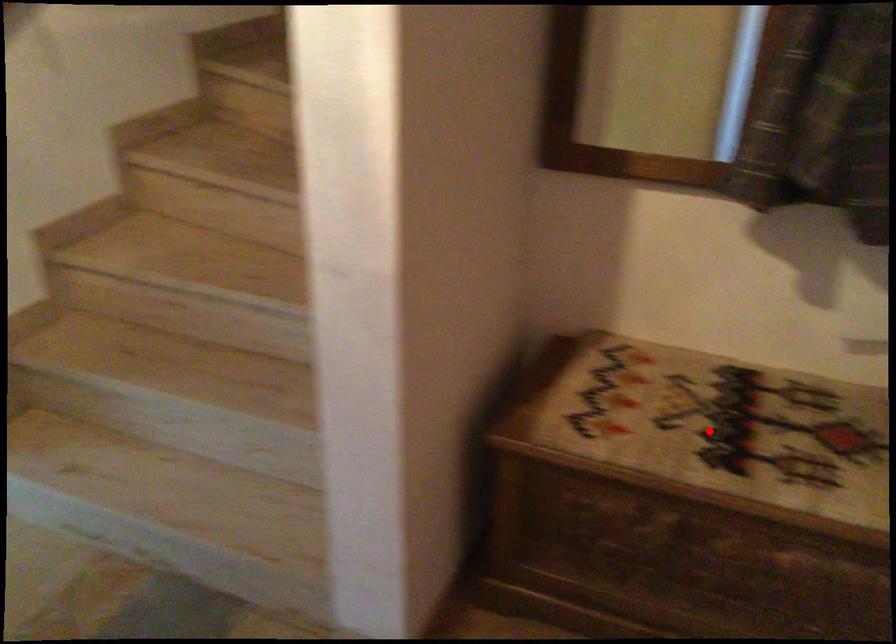
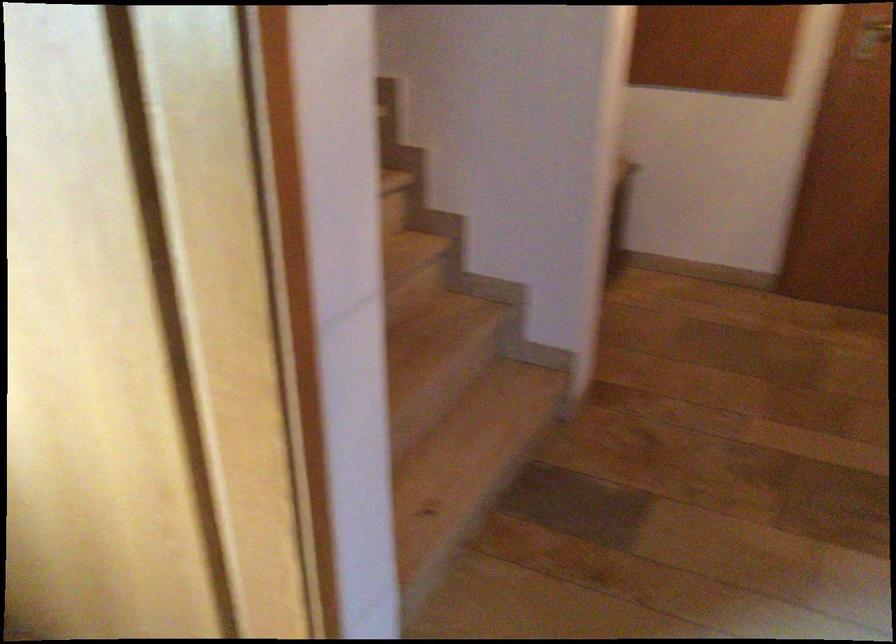
Question: I am providing you with two images of the same scene from different viewpoints. A red point is marked on the first image. At the location where the point appears in image 1, is it still visible in image 2?

Choices:
 (A) Yes
 (B) No

Answer: (B)